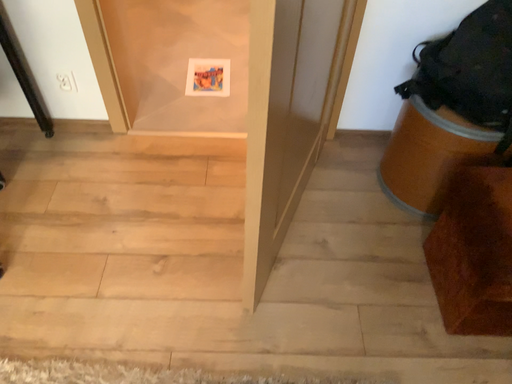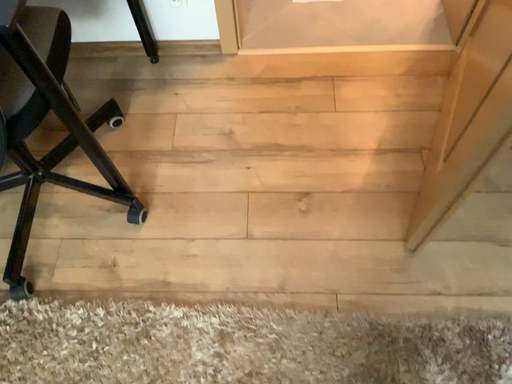
Question: How did the camera likely rotate when shooting the video?

Choices:
 (A) rotated downward
 (B) rotated upward

Answer: (A)